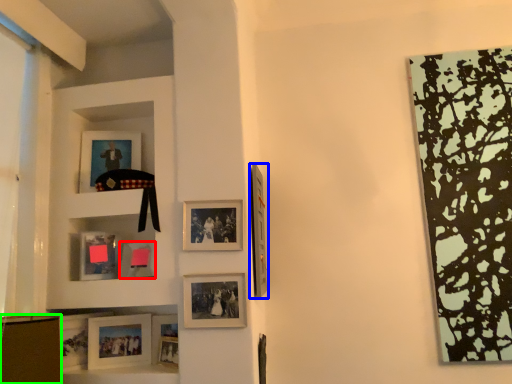
Question: Which object is positioned closest to picture frame (highlighted by a red box)? Select from picture frame (highlighted by a blue box) and shelf (highlighted by a green box).

Choices:
 (A) picture frame
 (B) shelf

Answer: (B)